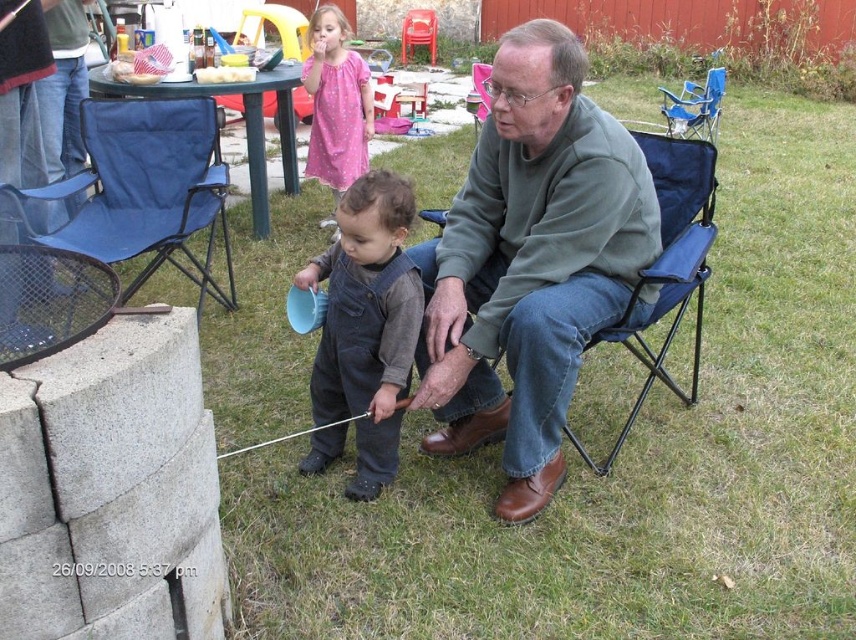
Measure the distance from green cotton sweater at center to blue fabric chair at left.

green cotton sweater at center and blue fabric chair at left are 4.88 feet apart.

Does green cotton sweater at center have a lesser height compared to blue fabric chair at left?

Incorrect, green cotton sweater at center's height does not fall short of blue fabric chair at left's.

The height and width of the screenshot is (640, 856). What are the coordinates of `green cotton sweater at center` in the screenshot? It's located at (530, 262).

Measure the distance between blue fabric chair at left and red plastic chair at center.

blue fabric chair at left is 8.16 meters from red plastic chair at center.

Locate an element on the screen. blue fabric chair at left is located at coordinates (141, 189).

Describe the element at coordinates (367, 323) in the screenshot. I see `denim overalls at center` at that location.

Is denim overalls at center further to the viewer compared to pink satin dress at upper center?

That is False.

Measure the distance between point (355, 460) and camera.

Point (355, 460) and camera are 2.51 meters apart from each other.

Where is `denim overalls at center`? Image resolution: width=856 pixels, height=640 pixels. denim overalls at center is located at coordinates (367, 323).